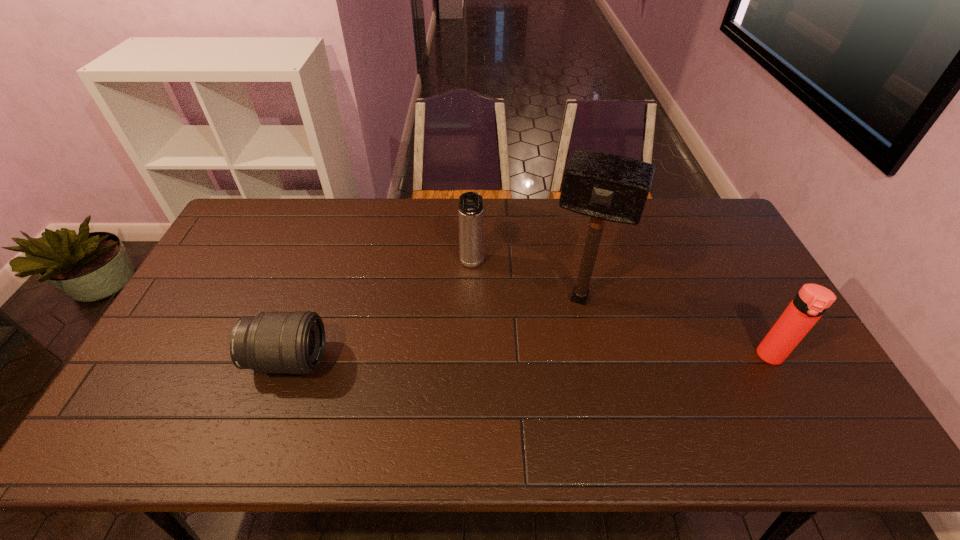
Identify the location of empty location between the second farthest object and the right thermos bottle. The height and width of the screenshot is (540, 960). (675, 327).

At what (x,y) coordinates should I click in order to perform the action: click on free spot between the nearer thermos bottle and the farthest object. Please return your answer as a coordinate pair (x, y). This screenshot has width=960, height=540. Looking at the image, I should click on (621, 310).

Where is `vacant space that's between the shortest object and the third object from right to left`? The width and height of the screenshot is (960, 540). vacant space that's between the shortest object and the third object from right to left is located at coordinates (380, 312).

Identify the location of the third closest object to the rightmost object. click(x=271, y=342).

Where is `the third closest object to the right thermos bottle`? The height and width of the screenshot is (540, 960). the third closest object to the right thermos bottle is located at coordinates 271,342.